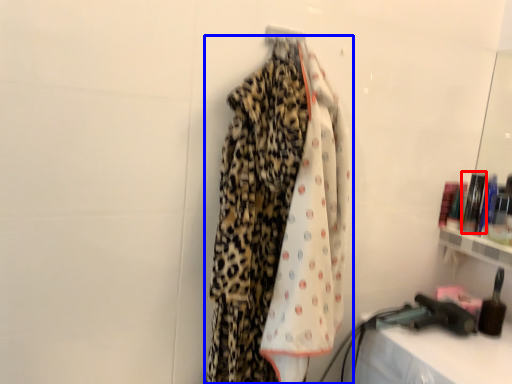
Question: Which of the following is the farthest to the observer, toiletry (highlighted by a red box) or curtain (highlighted by a blue box)?

Choices:
 (A) toiletry
 (B) curtain

Answer: (A)